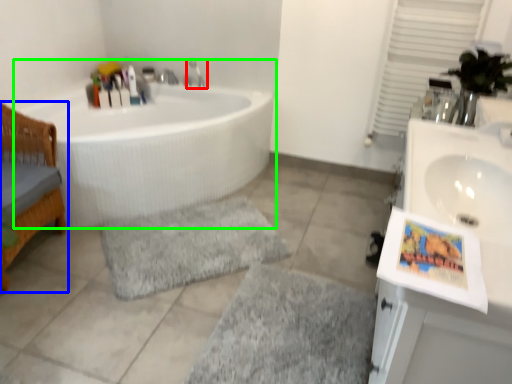
Question: Estimate the real-world distances between objects in this image. Which object is farther from tap (highlighted by a red box), furniture (highlighted by a blue box) or bathtub (highlighted by a green box)?

Choices:
 (A) furniture
 (B) bathtub

Answer: (A)